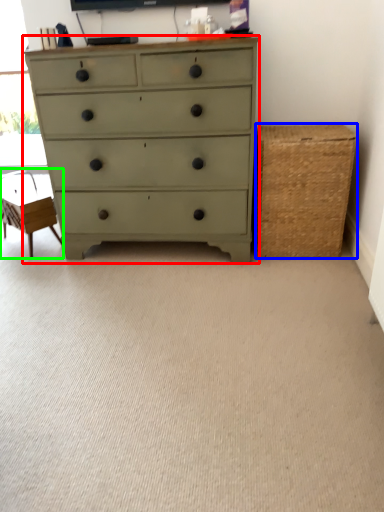
Question: Considering the real-world distances, which object is farthest from chest of drawers (highlighted by a red box)? basket (highlighted by a blue box) or swivel chair (highlighted by a green box)?

Choices:
 (A) basket
 (B) swivel chair

Answer: (B)